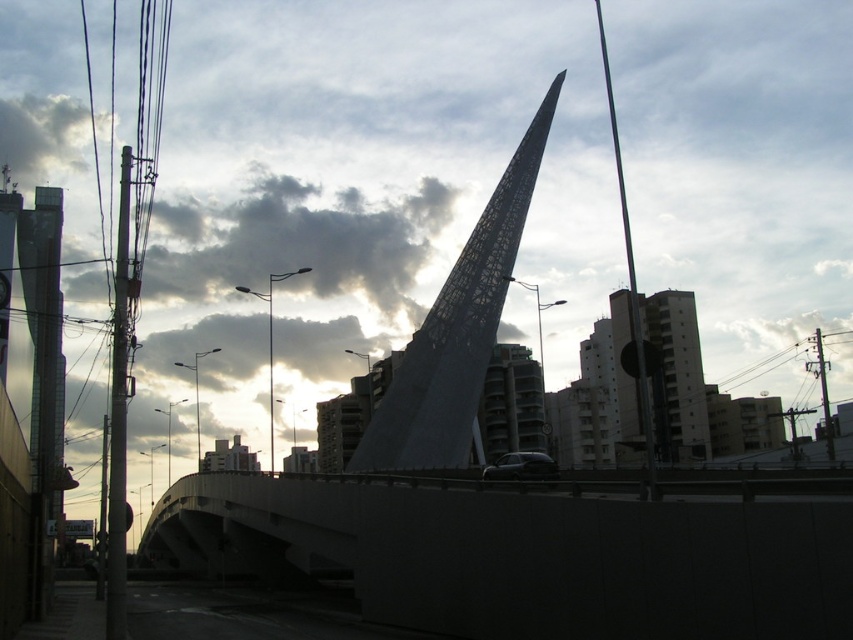
Does concrete bridge at center have a lesser width compared to metallic lattice spire at center?

Incorrect, concrete bridge at center's width is not less than metallic lattice spire at center's.

Can you confirm if concrete bridge at center is positioned above metallic lattice spire at center?

Actually, concrete bridge at center is below metallic lattice spire at center.

Who is more forward, (511, 541) or (421, 412)?

Positioned in front is point (511, 541).

The width and height of the screenshot is (853, 640). In order to click on concrete bridge at center in this screenshot , I will do `click(532, 552)`.

Is concrete bridge at center below shiny black car at center?

Correct, concrete bridge at center is located below shiny black car at center.

Who is more forward, (734,572) or (502,461)?

Point (734,572) is in front.

Identify the location of concrete bridge at center. The height and width of the screenshot is (640, 853). (532, 552).

Is point (699, 401) closer to viewer compared to point (534, 468)?

No, it is behind (534, 468).

Does white concrete building at center have a lesser height compared to shiny black car at center?

No, white concrete building at center is not shorter than shiny black car at center.

Which is behind, point (607, 387) or point (485, 474)?

The point (607, 387) is behind.

At what (x,y) coordinates should I click in order to perform the action: click on white concrete building at center. Please return your answer as a coordinate pair (x, y). The height and width of the screenshot is (640, 853). Looking at the image, I should click on (675, 376).